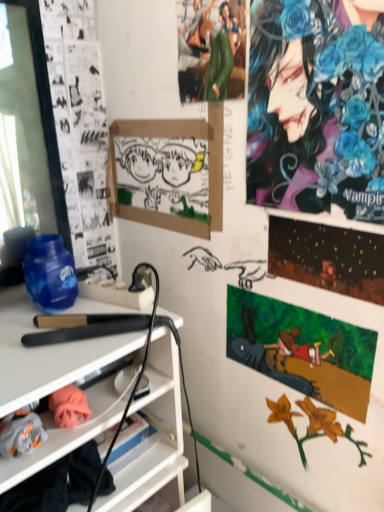
Question: From a real-world perspective, is shiny metallic poster at upper right, the 1th poster page positioned from the top, physically below watercolor paper painting at upper right, which appears as the first poster page when ordered from the bottom?

Choices:
 (A) yes
 (B) no

Answer: (B)

Question: From the image's perspective, is shiny metallic poster at upper right, the 1th poster page positioned from the top, on watercolor paper painting at upper right, which appears as the first poster page when ordered from the bottom?

Choices:
 (A) yes
 (B) no

Answer: (A)

Question: Is shiny metallic poster at upper right, which is the 2th poster page in bottom-to-top order, oriented away from watercolor paper painting at upper right, which appears as the first poster page when ordered from the bottom?

Choices:
 (A) no
 (B) yes

Answer: (A)

Question: Considering the relative sizes of shiny metallic poster at upper right, the 1th poster page positioned from the top, and watercolor paper painting at upper right, which appears as the first poster page when ordered from the bottom, in the image provided, is shiny metallic poster at upper right, the 1th poster page positioned from the top, wider than watercolor paper painting at upper right, which appears as the first poster page when ordered from the bottom,?

Choices:
 (A) no
 (B) yes

Answer: (B)

Question: Is shiny metallic poster at upper right, the 1th poster page positioned from the top, to the right of watercolor paper painting at upper right, which appears as the first poster page when ordered from the bottom, from the viewer's perspective?

Choices:
 (A) yes
 (B) no

Answer: (A)

Question: In the image, is black matte hair straightener at center left on the left side or the right side of shiny blue flowers at upper right, which appears as the 2th person when viewed from the left?

Choices:
 (A) right
 (B) left

Answer: (B)

Question: Is black matte hair straightener at center left spatially inside shiny blue flowers at upper right, the first person from the right, or outside of it?

Choices:
 (A) outside
 (B) inside

Answer: (A)

Question: From the image's perspective, is black matte hair straightener at center left above or below shiny blue flowers at upper right, which appears as the 2th person when viewed from the left?

Choices:
 (A) below
 (B) above

Answer: (A)

Question: Relative to shiny blue flowers at upper right, the first person from the right, is black matte hair straightener at center left in front or behind?

Choices:
 (A) front
 (B) behind

Answer: (B)

Question: Considering the positions of watercolor paper painting at upper right, which appears as the first poster page when ordered from the bottom, and black matte hair straightener at center left in the image, is watercolor paper painting at upper right, which appears as the first poster page when ordered from the bottom, wider or thinner than black matte hair straightener at center left?

Choices:
 (A) thin
 (B) wide

Answer: (A)

Question: Considering the positions of point (342, 350) and point (69, 323), is point (342, 350) closer or farther from the camera than point (69, 323)?

Choices:
 (A) closer
 (B) farther

Answer: (B)

Question: From the image's perspective, is watercolor paper painting at upper right, which appears as the first poster page when ordered from the bottom, located above or below black matte hair straightener at center left?

Choices:
 (A) above
 (B) below

Answer: (B)

Question: Is watercolor paper painting at upper right, which appears as the first poster page when ordered from the bottom, taller or shorter than black matte hair straightener at center left?

Choices:
 (A) tall
 (B) short

Answer: (A)

Question: From the image's perspective, relative to green fabric figure at upper center, marked as the 2th person in a right-to-left arrangement, is shiny metallic poster at upper right, which is the 2th poster page in bottom-to-top order, above or below?

Choices:
 (A) above
 (B) below

Answer: (B)

Question: Is shiny metallic poster at upper right, the 1th poster page positioned from the top, taller or shorter than green fabric figure at upper center, the 1th person when ordered from left to right?

Choices:
 (A) tall
 (B) short

Answer: (B)